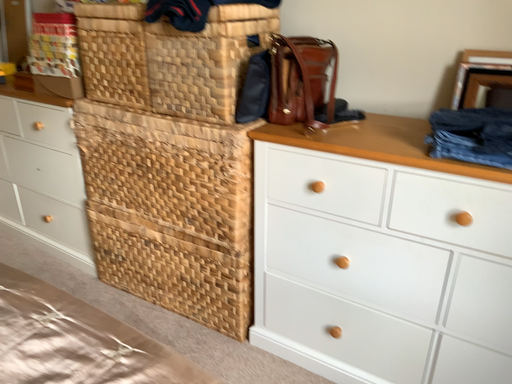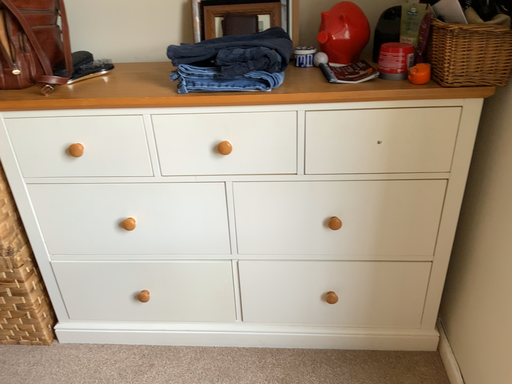
Question: How did the camera likely rotate when shooting the video?

Choices:
 (A) rotated right
 (B) rotated left

Answer: (A)